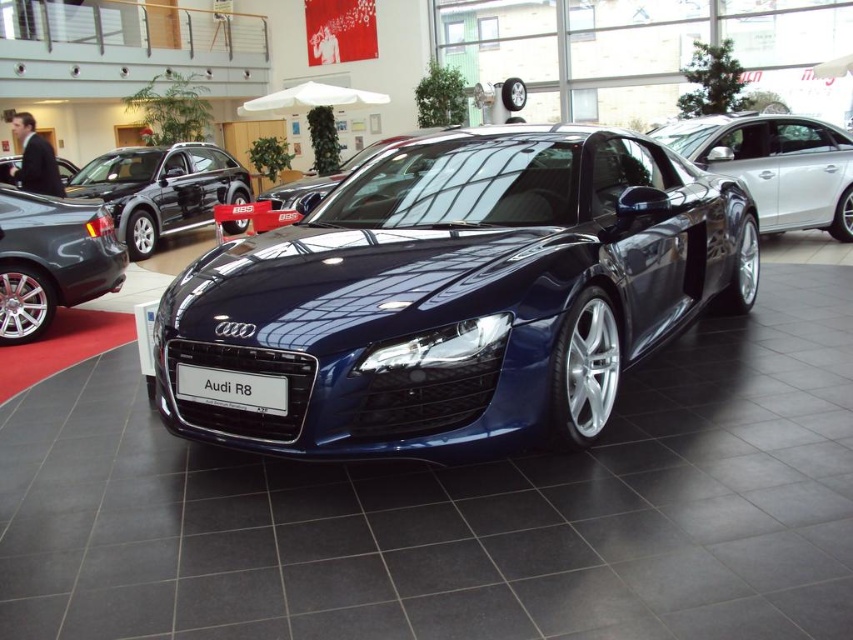
You are standing in the showroom and want to take a photo of the Audi R8 sports car. If the camera you are using has a focal length of 50mm and you want to capture the entire car in the frame, would you need to move closer or farther away from the point at coordinates point (207, 376)?

The point at coordinates point (207, 376) is 6.83 feet away from the camera. To capture the entire car in the frame with a 50mm focal length, you would need to move farther away from the point at coordinates point (207, 376) to ensure the car fits within the camera sensor dimensions.

You are a car enthusiast visiting the showroom and want to know which car is taller between the satin blue car at center and the glossy black car at left. Can you tell me based on their positions?

The satin blue car at center is taller than the glossy black car at left.